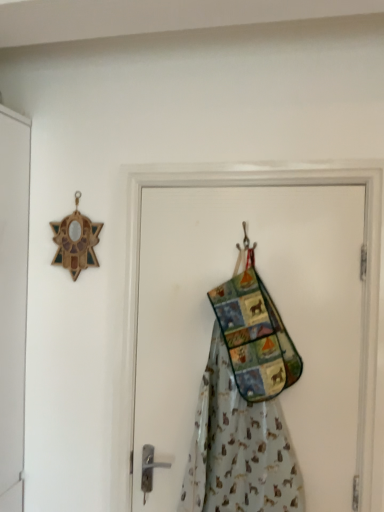
Question: Is metallic hook at center beside textured fabric apron at center?

Choices:
 (A) no
 (B) yes

Answer: (A)

Question: Does metallic hook at center appear on the left side of textured fabric apron at center?

Choices:
 (A) no
 (B) yes

Answer: (A)

Question: From a real-world perspective, is metallic hook at center on textured fabric apron at center?

Choices:
 (A) yes
 (B) no

Answer: (A)

Question: Does metallic hook at center lie in front of textured fabric apron at center?

Choices:
 (A) no
 (B) yes

Answer: (A)

Question: Is metallic hook at center not close to textured fabric apron at center?

Choices:
 (A) yes
 (B) no

Answer: (B)

Question: From the image's perspective, is metallic hook at center above textured fabric apron at center?

Choices:
 (A) yes
 (B) no

Answer: (A)

Question: Does textured fabric apron at center have a smaller size compared to fabric patchwork bag at center?

Choices:
 (A) no
 (B) yes

Answer: (A)

Question: Is textured fabric apron at center positioned far away from fabric patchwork bag at center?

Choices:
 (A) no
 (B) yes

Answer: (A)

Question: Does textured fabric apron at center turn towards fabric patchwork bag at center?

Choices:
 (A) no
 (B) yes

Answer: (B)

Question: Is textured fabric apron at center shorter than fabric patchwork bag at center?

Choices:
 (A) yes
 (B) no

Answer: (A)

Question: Is textured fabric apron at center bigger than fabric patchwork bag at center?

Choices:
 (A) yes
 (B) no

Answer: (A)

Question: Is textured fabric apron at center to the right of fabric patchwork bag at center from the viewer's perspective?

Choices:
 (A) yes
 (B) no

Answer: (B)

Question: Is fabric patchwork bag at center aimed at metallic hook at center?

Choices:
 (A) yes
 (B) no

Answer: (A)